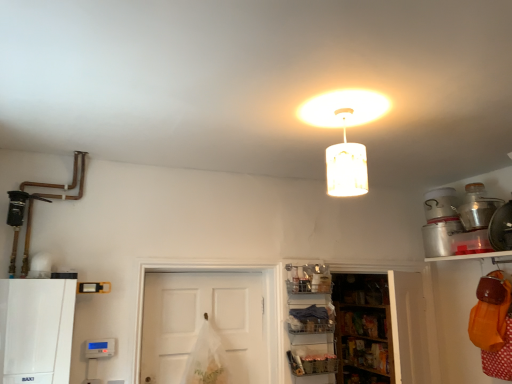
Question: Is white matte cabinet at lower left located outside metallic silver container at upper right?

Choices:
 (A) no
 (B) yes

Answer: (B)

Question: Is white matte cabinet at lower left positioned behind metallic silver container at upper right?

Choices:
 (A) yes
 (B) no

Answer: (B)

Question: Is the surface of white matte cabinet at lower left in direct contact with metallic silver container at upper right?

Choices:
 (A) no
 (B) yes

Answer: (A)

Question: Is the depth of white matte cabinet at lower left less than that of metallic silver container at upper right?

Choices:
 (A) no
 (B) yes

Answer: (B)

Question: Is white matte cabinet at lower left wider than metallic silver container at upper right?

Choices:
 (A) yes
 (B) no

Answer: (A)

Question: From the image's perspective, is white matte cabinet at lower left over metallic silver container at upper right?

Choices:
 (A) no
 (B) yes

Answer: (A)

Question: Is the position of white matte cabinet at lower left more distant than that of white plastic basket at lower center, arranged as the 1th shelf when viewed from the left?

Choices:
 (A) no
 (B) yes

Answer: (A)

Question: From a real-world perspective, is white matte cabinet at lower left under white plastic basket at lower center, arranged as the 4th shelf when viewed from the right?

Choices:
 (A) yes
 (B) no

Answer: (A)

Question: Is white matte cabinet at lower left smaller than white plastic basket at lower center, arranged as the 1th shelf when viewed from the left?

Choices:
 (A) yes
 (B) no

Answer: (B)

Question: Does white matte cabinet at lower left appear on the left side of white plastic basket at lower center, arranged as the 1th shelf when viewed from the left?

Choices:
 (A) no
 (B) yes

Answer: (B)

Question: From the image's perspective, is white matte cabinet at lower left located above white plastic basket at lower center, arranged as the 4th shelf when viewed from the right?

Choices:
 (A) no
 (B) yes

Answer: (B)

Question: Is white matte cabinet at lower left aimed at white plastic basket at lower center, arranged as the 1th shelf when viewed from the left?

Choices:
 (A) yes
 (B) no

Answer: (B)

Question: Is metallic silver shelf at lower right, the second shelf from the left, at the right side of orange fabric bag at lower right, which ranks as the 4th shelf in left-to-right order?

Choices:
 (A) no
 (B) yes

Answer: (A)